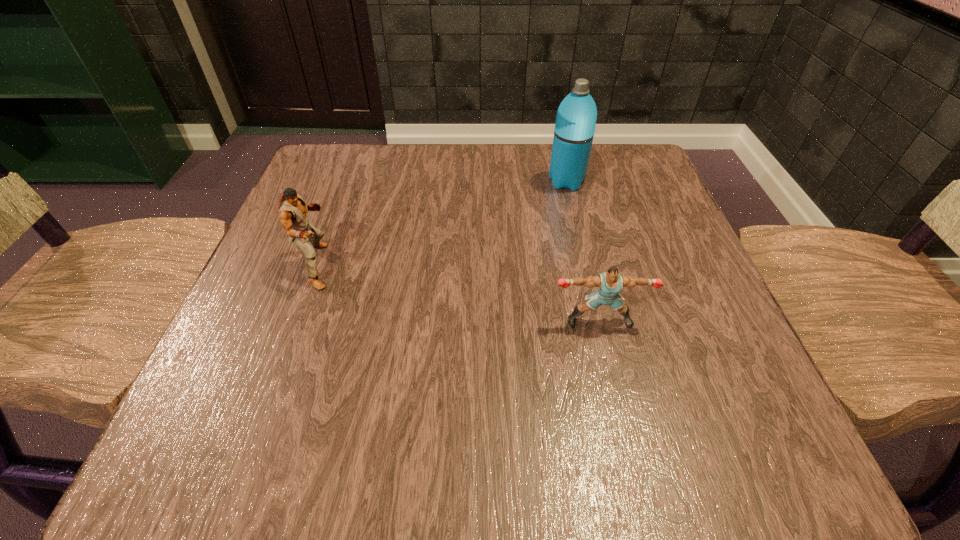
Locate an element on the screen. The image size is (960, 540). object that is at the left edge is located at coordinates (292, 209).

This screenshot has height=540, width=960. What are the coordinates of `thermos bottle located in the right edge section of the desktop` in the screenshot? It's located at (574, 130).

This screenshot has height=540, width=960. Identify the location of puncher situated at the right edge. (609, 284).

This screenshot has height=540, width=960. I want to click on object situated at the far right corner, so click(574, 130).

I want to click on vacant space at the far edge of the desktop, so click(x=420, y=190).

Image resolution: width=960 pixels, height=540 pixels. In order to click on vacant area at the near edge of the desktop in this screenshot , I will do `click(549, 416)`.

In the image, there is a desktop. Where is `vacant space at the left edge`? vacant space at the left edge is located at coordinates (258, 279).

Image resolution: width=960 pixels, height=540 pixels. In order to click on free space at the right edge of the desktop in this screenshot , I will do `click(602, 228)`.

In the image, there is a desktop. At what (x,y) coordinates should I click in order to perform the action: click on vacant space at the far left corner. Please return your answer as a coordinate pair (x, y). Image resolution: width=960 pixels, height=540 pixels. Looking at the image, I should click on (374, 165).

The width and height of the screenshot is (960, 540). In the image, there is a desktop. In order to click on vacant area at the near left corner in this screenshot , I will do `click(180, 469)`.